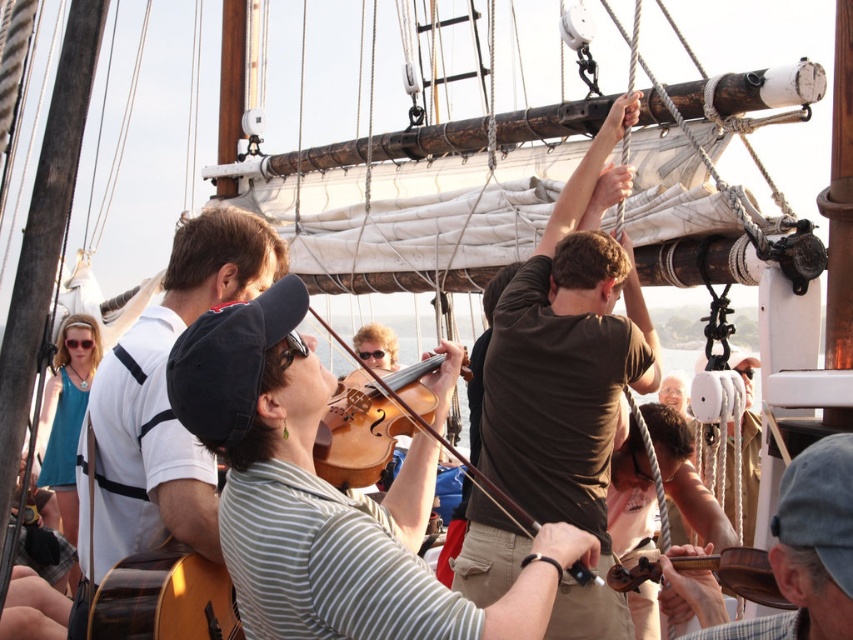
Question: Does wooden guitar at left appear on the right side of wooden violin at center?

Choices:
 (A) yes
 (B) no

Answer: (B)

Question: Does light brown wood guitar at lower left have a lesser width compared to wooden violin at center?

Choices:
 (A) yes
 (B) no

Answer: (A)

Question: Which point is farther from the camera taking this photo?

Choices:
 (A) (367, 435)
 (B) (654, 348)
 (C) (198, 630)

Answer: (B)

Question: From the image, what is the correct spatial relationship of brown cotton shirt at upper center in relation to wooden violin at lower right?

Choices:
 (A) right
 (B) left

Answer: (B)

Question: Based on their relative distances, which object is nearer to the wooden violin at center?

Choices:
 (A) light brown wood guitar at lower left
 (B) brown cotton shirt at upper center

Answer: (B)

Question: Which of the following is the farthest from the observer?

Choices:
 (A) (367, 388)
 (B) (614, 300)

Answer: (B)